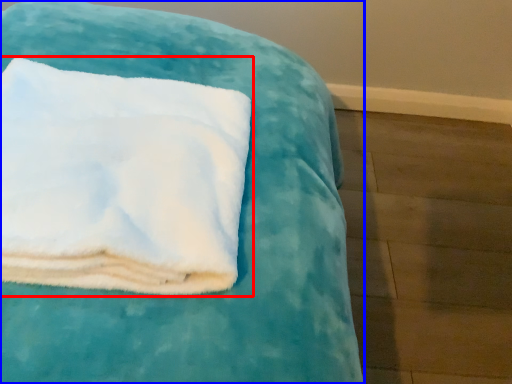
Question: Which object appears closest to the camera in this image, towel (highlighted by a red box) or furniture (highlighted by a blue box)?

Choices:
 (A) towel
 (B) furniture

Answer: (A)